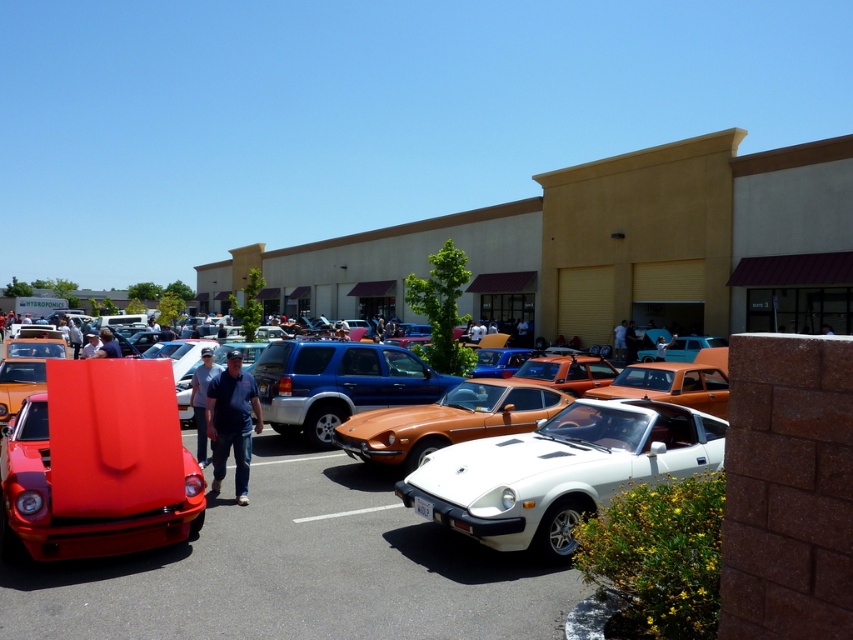
Question: Estimate the real-world distances between objects in this image. Which object is farther from the white matte convertible at center?

Choices:
 (A) shiny orange car at center
 (B) orange metallic sports car at center
 (C) orange matte sports car at center

Answer: (C)

Question: Is white matte convertible at center above orange metallic sports car at center?

Choices:
 (A) yes
 (B) no

Answer: (B)

Question: Based on their relative distances, which object is farther from the orange metallic sports car at center?

Choices:
 (A) white matte convertible at center
 (B) orange matte sports car at center

Answer: (B)

Question: Does shiny orange car at center lie behind orange matte sports car at center?

Choices:
 (A) yes
 (B) no

Answer: (B)

Question: Is shiny orange car at center positioned before orange metallic sports car at center?

Choices:
 (A) no
 (B) yes

Answer: (B)

Question: Which object appears farthest from the camera in this image?

Choices:
 (A) orange metallic sports car at center
 (B) shiny orange car at center
 (C) orange matte sports car at center
 (D) white matte convertible at center

Answer: (C)